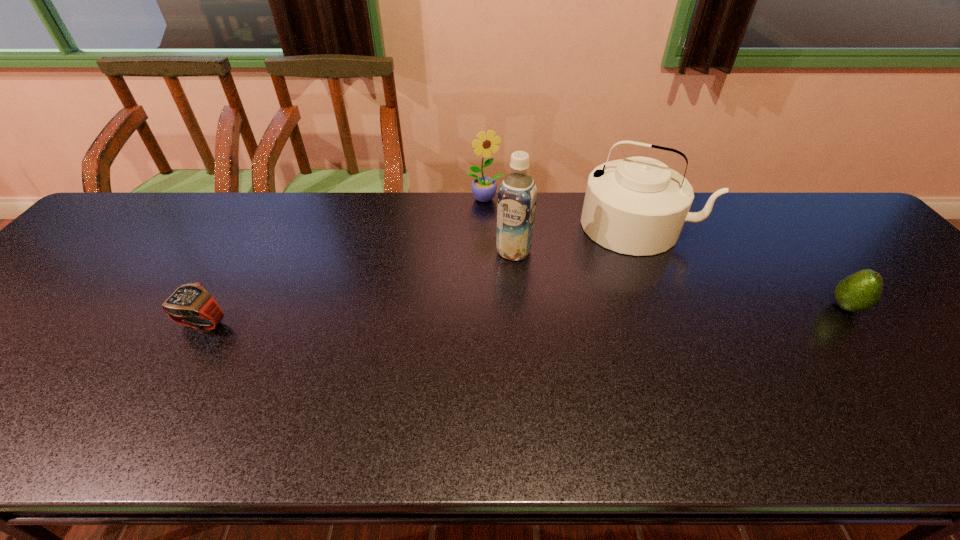
Where is `kettle that is at the far edge`? This screenshot has height=540, width=960. kettle that is at the far edge is located at coordinates (637, 206).

Locate an element on the screen. The image size is (960, 540). free location at the far edge is located at coordinates (352, 228).

This screenshot has height=540, width=960. Identify the location of vacant space at the near edge of the desktop. (43, 376).

Locate an element on the screen. This screenshot has width=960, height=540. vacant space at the left edge of the desktop is located at coordinates (69, 306).

Where is `vacant space at the right edge of the desktop`? The image size is (960, 540). vacant space at the right edge of the desktop is located at coordinates (902, 301).

Identify the location of free space at the far right corner of the desktop. The width and height of the screenshot is (960, 540). (815, 205).

Identify the location of free point between the fourth object from left to right and the sunflower. The image size is (960, 540). (562, 212).

Find the location of a particular element. free space that is in between the soya milk and the shortest object is located at coordinates (358, 287).

Where is `free space between the watch and the rightmost object`? Image resolution: width=960 pixels, height=540 pixels. free space between the watch and the rightmost object is located at coordinates (524, 315).

Find the location of a particular element. free space between the fourth object from left to right and the avocado is located at coordinates (x=742, y=266).